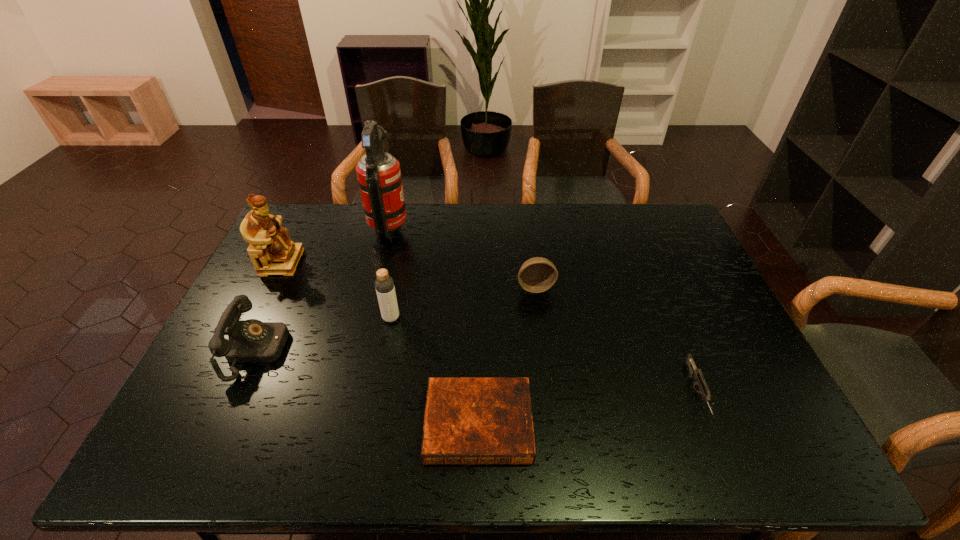
The width and height of the screenshot is (960, 540). Find the location of `the tallest object`. the tallest object is located at coordinates (379, 176).

At what (x,y) coordinates should I click in order to perform the action: click on fire extinguisher. Please return your answer as a coordinate pair (x, y). Looking at the image, I should click on (379, 176).

The height and width of the screenshot is (540, 960). In order to click on the sixth shortest object in this screenshot , I will do `click(269, 241)`.

Find the location of `the sixth nearest object`. the sixth nearest object is located at coordinates (269, 241).

At what (x,y) coordinates should I click in order to perform the action: click on bottle. Please return your answer as a coordinate pair (x, y). The image size is (960, 540). Looking at the image, I should click on (x=384, y=284).

Find the location of a particular element. telephone is located at coordinates (249, 341).

Image resolution: width=960 pixels, height=540 pixels. I want to click on bowl, so click(x=536, y=275).

This screenshot has width=960, height=540. Identify the location of the rightmost object. (694, 372).

Identify the location of gun. The image size is (960, 540). (694, 372).

This screenshot has height=540, width=960. In order to click on the shortest object in this screenshot , I will do `click(467, 420)`.